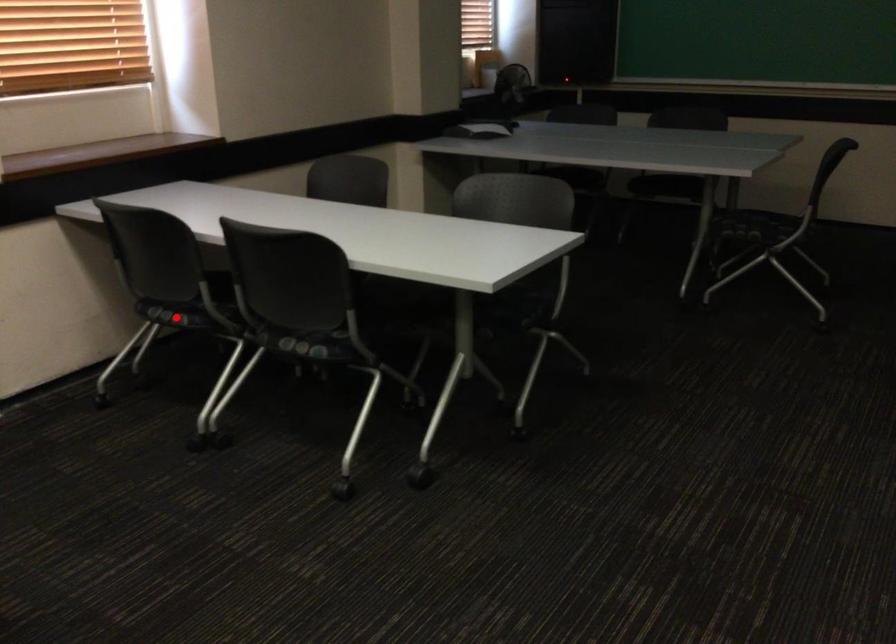
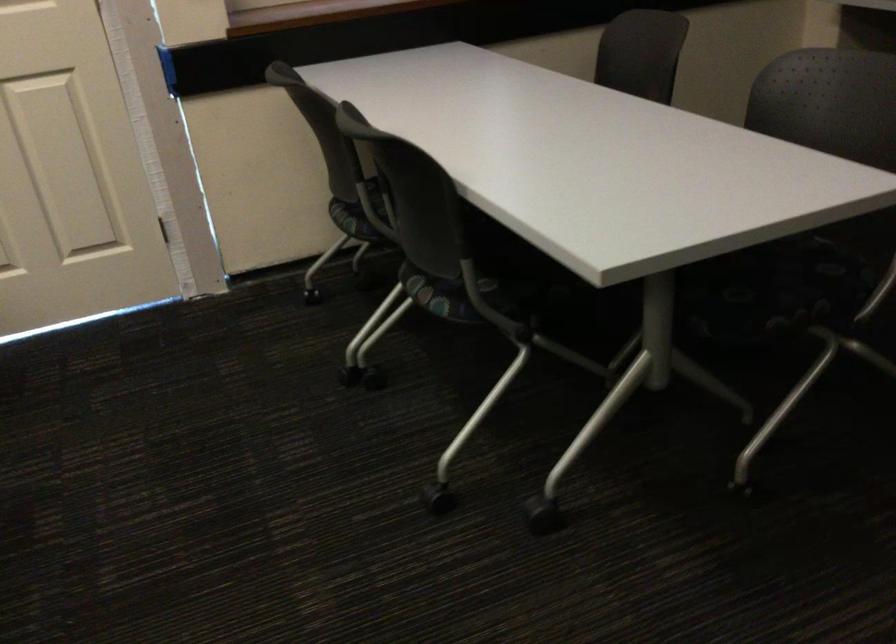
In the second image, find the point that corresponds to the highlighted location in the first image.

(350, 220)